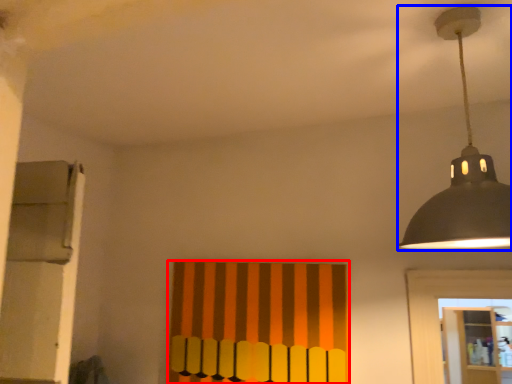
Question: Which object appears farthest to the camera in this image, curtain (highlighted by a red box) or lamp (highlighted by a blue box)?

Choices:
 (A) curtain
 (B) lamp

Answer: (A)